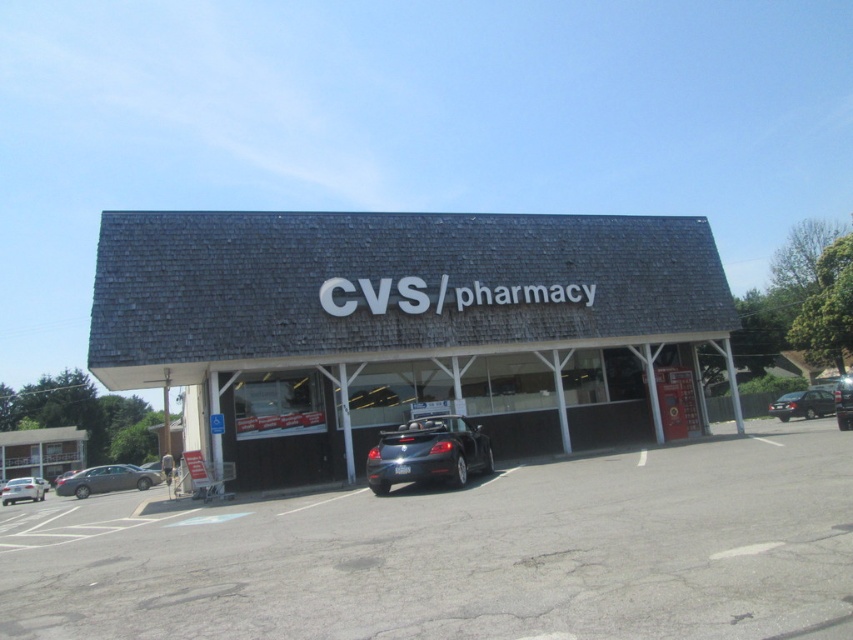
You are standing in front of the CVS store and want to walk to the shiny black convertible at center. Which direction should you walk to reach it from the asphalt at center?

The asphalt at center is located below the shiny black convertible at center, so you should walk upwards towards the shiny black convertible at center to reach it.